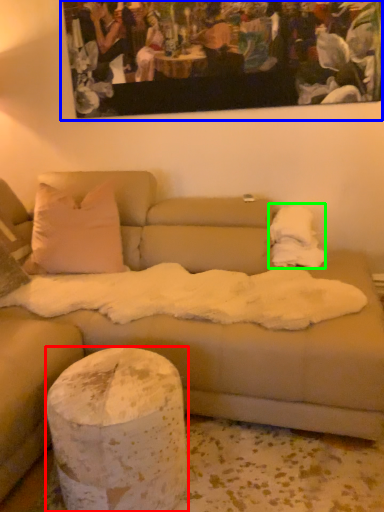
Question: Considering the real-world distances, which object is farthest from pillar (highlighted by a red box)? picture frame (highlighted by a blue box) or blanket (highlighted by a green box)?

Choices:
 (A) picture frame
 (B) blanket

Answer: (A)